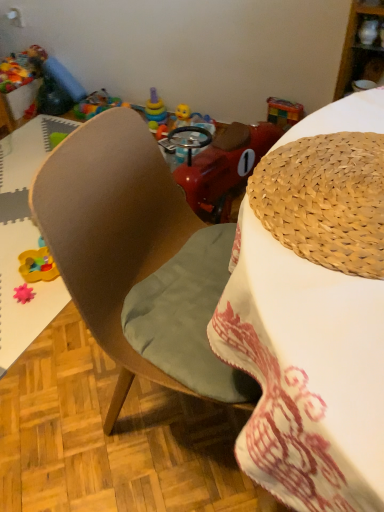
The height and width of the screenshot is (512, 384). What are the coordinates of `empty space that is to the right of pink rubber star at lower left, which ranks as the 1th toy in front-to-back order` in the screenshot? It's located at (52, 298).